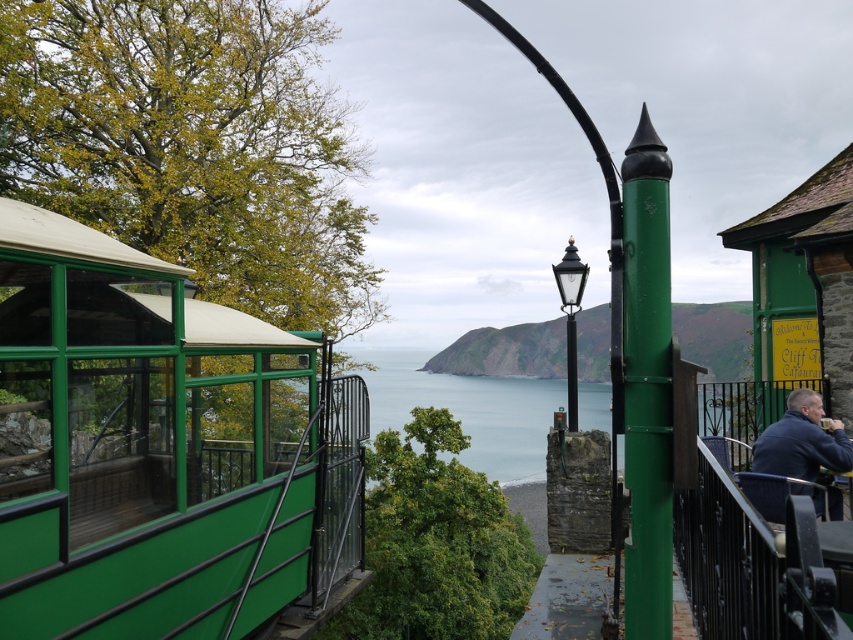
Question: Can you confirm if green matte pole at center-right is smaller than blue fabric jacket at right?

Choices:
 (A) yes
 (B) no

Answer: (A)

Question: Considering the real-world distances, which object is farthest from the green matte pole at center-right?

Choices:
 (A) black polished metal streetlight at center
 (B) green matte/glass cable car at left

Answer: (A)

Question: Does green matte/glass cable car at left lie behind blue fabric jacket at right?

Choices:
 (A) yes
 (B) no

Answer: (B)

Question: Which object is the farthest from the black polished metal streetlight at center?

Choices:
 (A) green matte pole at center-right
 (B) green matte/glass cable car at left
 (C) blue fabric jacket at right

Answer: (A)

Question: Among these objects, which one is nearest to the camera?

Choices:
 (A) black polished metal streetlight at center
 (B) green matte/glass cable car at left
 (C) blue fabric jacket at right

Answer: (B)

Question: Observing the image, what is the correct spatial positioning of green matte/glass cable car at left in reference to black polished metal streetlight at center?

Choices:
 (A) left
 (B) right

Answer: (A)